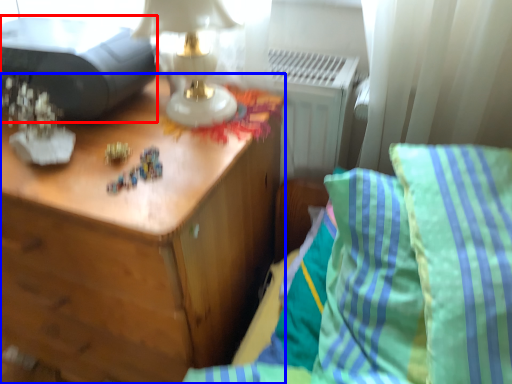
Question: Among these objects, which one is farthest to the camera, printer (highlighted by a red box) or nightstand (highlighted by a blue box)?

Choices:
 (A) printer
 (B) nightstand

Answer: (A)